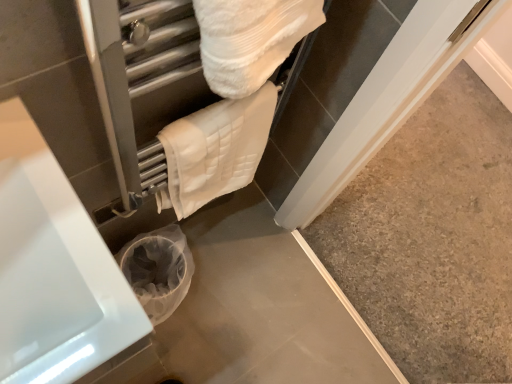
Question: From a real-world perspective, is white glossy bathtub at lower left beneath white quilted towel at upper center?

Choices:
 (A) no
 (B) yes

Answer: (B)

Question: From the image's perspective, is white glossy bathtub at lower left above white quilted towel at upper center?

Choices:
 (A) no
 (B) yes

Answer: (A)

Question: Can you confirm if white glossy bathtub at lower left is shorter than white quilted towel at upper center?

Choices:
 (A) no
 (B) yes

Answer: (A)

Question: Considering the relative sizes of white glossy bathtub at lower left and white quilted towel at upper center in the image provided, is white glossy bathtub at lower left taller than white quilted towel at upper center?

Choices:
 (A) yes
 (B) no

Answer: (A)

Question: Does white glossy bathtub at lower left lie behind white quilted towel at upper center?

Choices:
 (A) yes
 (B) no

Answer: (B)

Question: Is white glossy bathtub at lower left to the left of white quilted towel at upper center from the viewer's perspective?

Choices:
 (A) no
 (B) yes

Answer: (B)

Question: Is white quilted towel at upper center at the right side of white glossy bathtub at lower left?

Choices:
 (A) yes
 (B) no

Answer: (A)

Question: Can white glossy bathtub at lower left be found inside white quilted towel at upper center?

Choices:
 (A) yes
 (B) no

Answer: (B)

Question: From a real-world perspective, is white quilted towel at upper center below white glossy bathtub at lower left?

Choices:
 (A) yes
 (B) no

Answer: (B)

Question: Does white quilted towel at upper center have a lesser height compared to white glossy bathtub at lower left?

Choices:
 (A) yes
 (B) no

Answer: (A)

Question: Is white quilted towel at upper center touching white glossy bathtub at lower left?

Choices:
 (A) yes
 (B) no

Answer: (B)

Question: Considering the relative sizes of white quilted towel at upper center and white glossy bathtub at lower left in the image provided, is white quilted towel at upper center smaller than white glossy bathtub at lower left?

Choices:
 (A) no
 (B) yes

Answer: (B)

Question: Is white quilted towel at upper center to the left or to the right of white glossy bathtub at lower left in the image?

Choices:
 (A) left
 (B) right

Answer: (B)